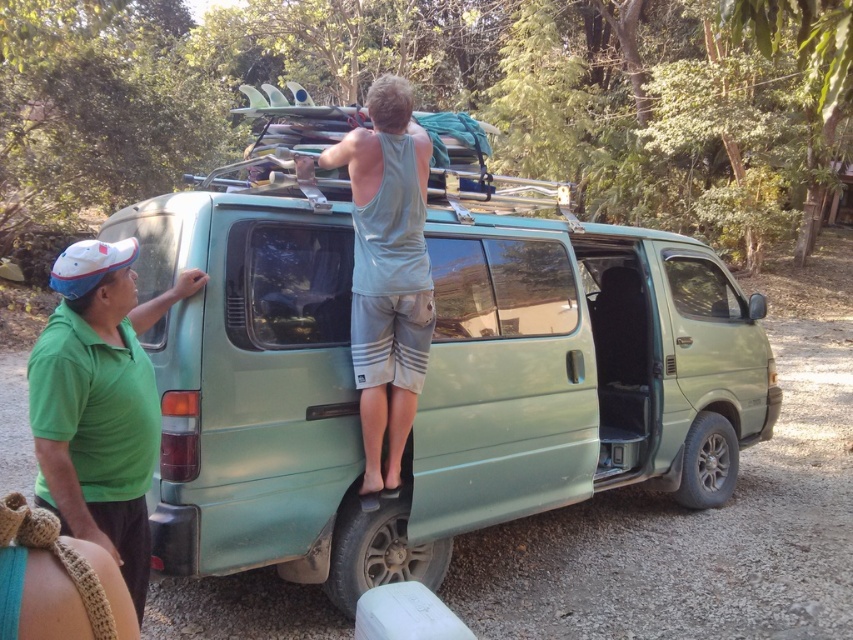
Between green matte van at center and green matte shirt at left, which one is positioned higher?

green matte shirt at left is above.

What are the coordinates of `green matte van at center` in the screenshot? It's located at (428, 378).

You are a GUI agent. You are given a task and a screenshot of the screen. Output one action in this format:
    pyautogui.click(x=<x>, y=<y>)
    Task: Click on the green matte van at center
    
    Given the screenshot: What is the action you would take?
    pyautogui.click(x=428, y=378)

Which is more to the right, green matte shirt at left or gray cotton shorts at center?

From the viewer's perspective, gray cotton shorts at center appears more on the right side.

Does green matte shirt at left have a larger size compared to gray cotton shorts at center?

Incorrect, green matte shirt at left is not larger than gray cotton shorts at center.

Does point (38, 470) come behind point (370, 106)?

No, (38, 470) is in front of (370, 106).

The width and height of the screenshot is (853, 640). Find the location of `green matte shirt at left`. green matte shirt at left is located at coordinates (99, 403).

Is green matte van at center taller than gray cotton shorts at center?

Yes.

Who is more forward, (260, 307) or (418, 312)?

Positioned in front is point (260, 307).

The height and width of the screenshot is (640, 853). Find the location of `green matte van at center`. green matte van at center is located at coordinates (428, 378).